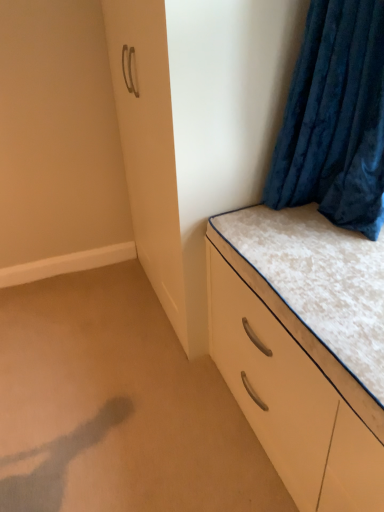
What are the coordinates of `vacant space situated on the left part of velvet blue curtain at upper right` in the screenshot? It's located at (263, 226).